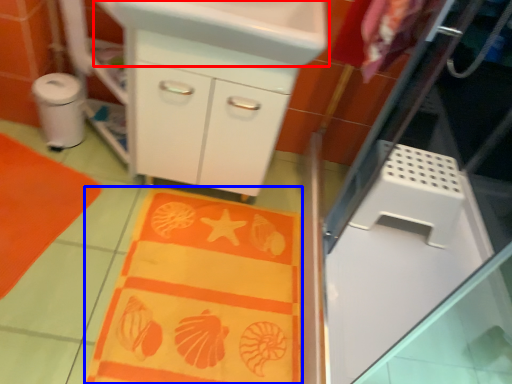
Question: Which point is further to the camera, sink (highlighted by a red box) or blanket (highlighted by a blue box)?

Choices:
 (A) sink
 (B) blanket

Answer: (B)